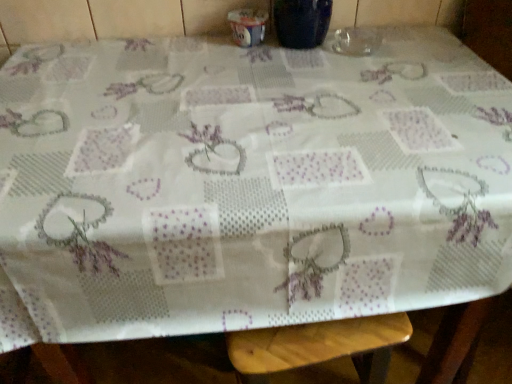
Locate an element on the screen. This screenshot has width=512, height=384. free space to the right of matte dark blue glass vase at upper center is located at coordinates (395, 44).